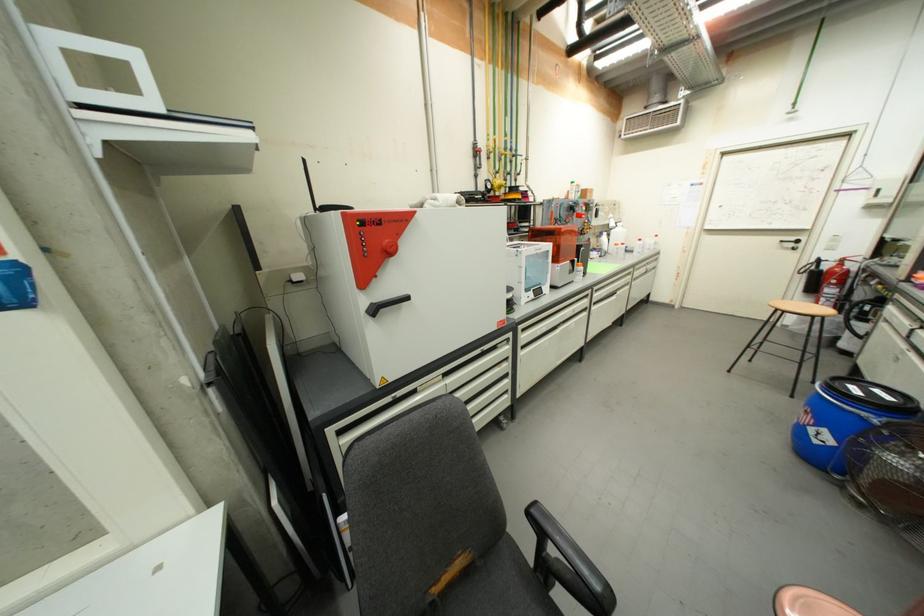
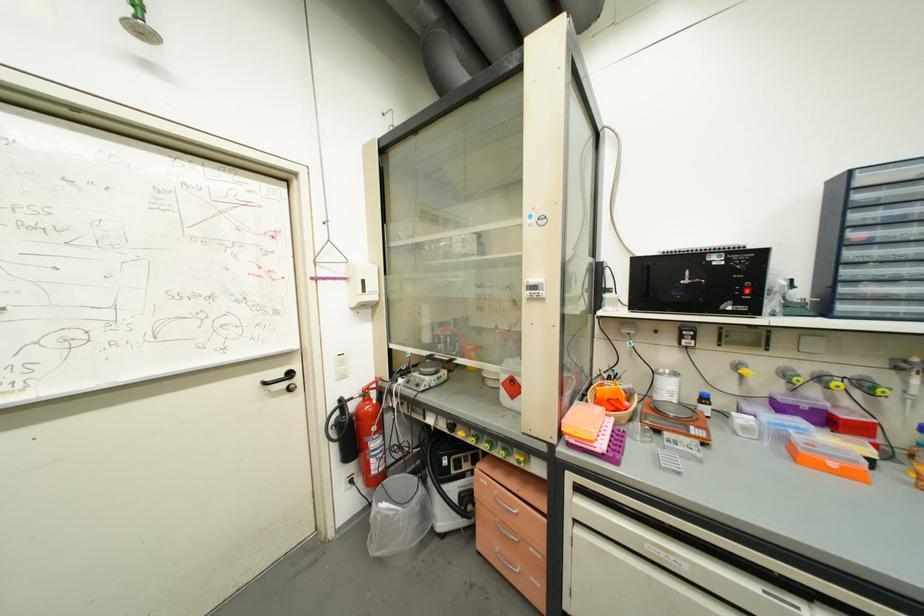
Find the pixel in the second image that matches (883,192) in the first image.

(369, 283)